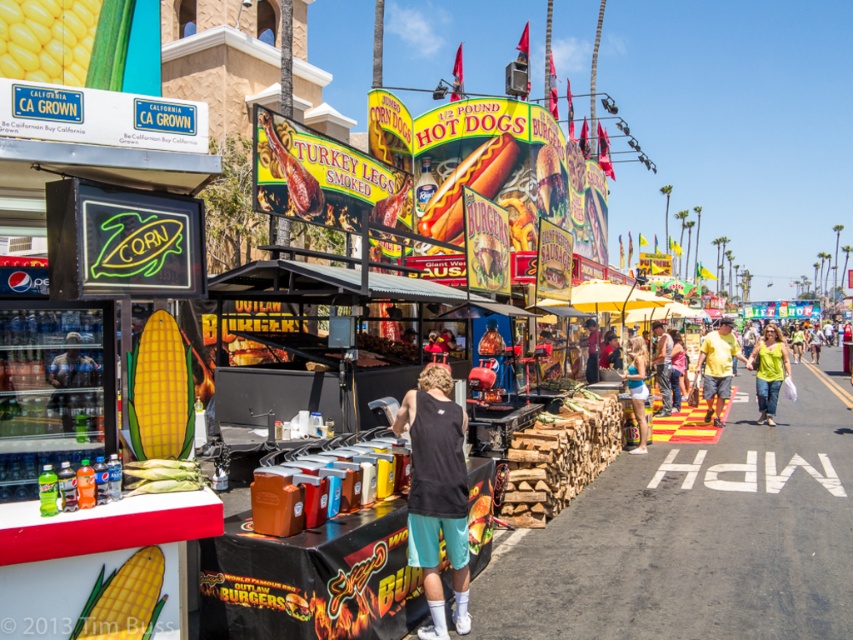
Is smoked turkey leg at center further to camera compared to white cotton tank top at center?

No.

Is smoked turkey leg at center shorter than white cotton tank top at center?

Yes.

The height and width of the screenshot is (640, 853). Find the location of `smoked turkey leg at center`. smoked turkey leg at center is located at coordinates [x=293, y=173].

Identify the location of smoked turkey leg at center. The width and height of the screenshot is (853, 640). (293, 173).

Who is more distant from viewer, (438, 506) or (451, 228)?

The point (451, 228) is more distant.

Is black cotton tank top at center thinner than shiny chrome hot dog at center?

Yes, black cotton tank top at center is thinner than shiny chrome hot dog at center.

Which is behind, point (444, 380) or point (495, 147)?

Point (495, 147)

At what (x,y) coordinates should I click in order to perform the action: click on black cotton tank top at center. Please return your answer as a coordinate pair (x, y). Image resolution: width=853 pixels, height=640 pixels. Looking at the image, I should click on (436, 492).

Is black cotton tank top at center smaller than yellow matte corn at upper left?

No.

Is the position of black cotton tank top at center more distant than that of yellow matte corn at upper left?

That is True.

Is point (444, 388) positioned behind point (78, 28)?

Yes, it is.

At what (x,y) coordinates should I click in order to perform the action: click on black cotton tank top at center. Please return your answer as a coordinate pair (x, y). Image resolution: width=853 pixels, height=640 pixels. Looking at the image, I should click on (436, 492).